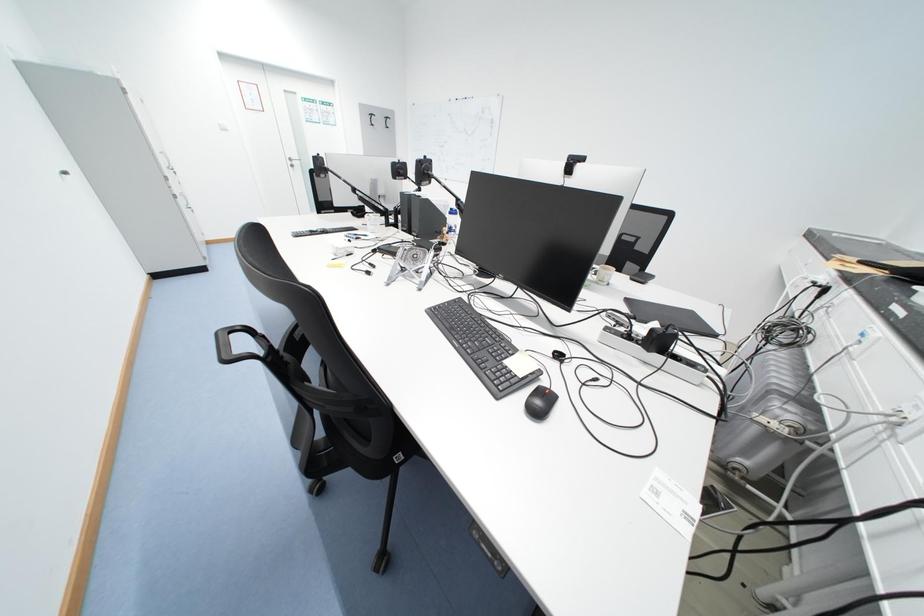
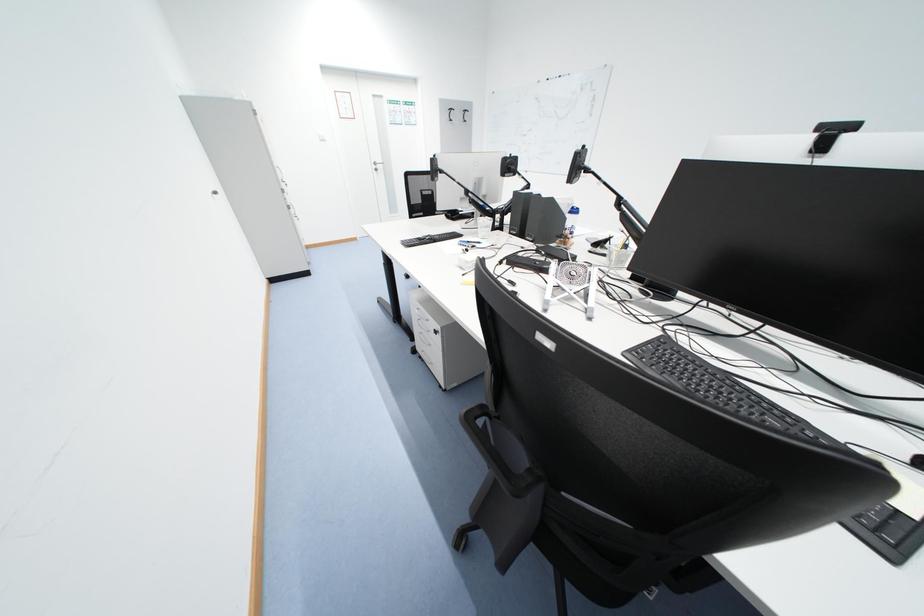
The images are taken continuously from a first-person perspective. In which direction are you moving?

The cameraman walked toward left, forward.